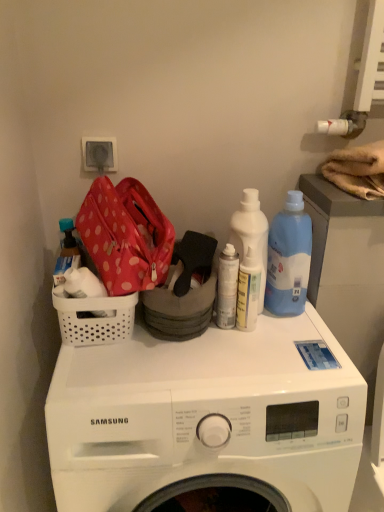
Identify the location of vacant area that is in front of white matte spray can at center, the 2th bottle viewed from the left. (227, 372).